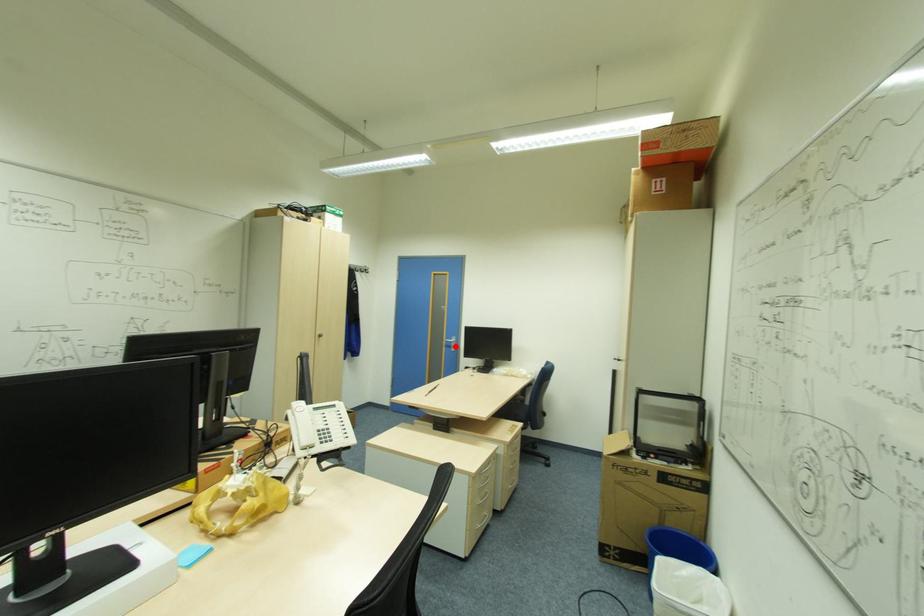
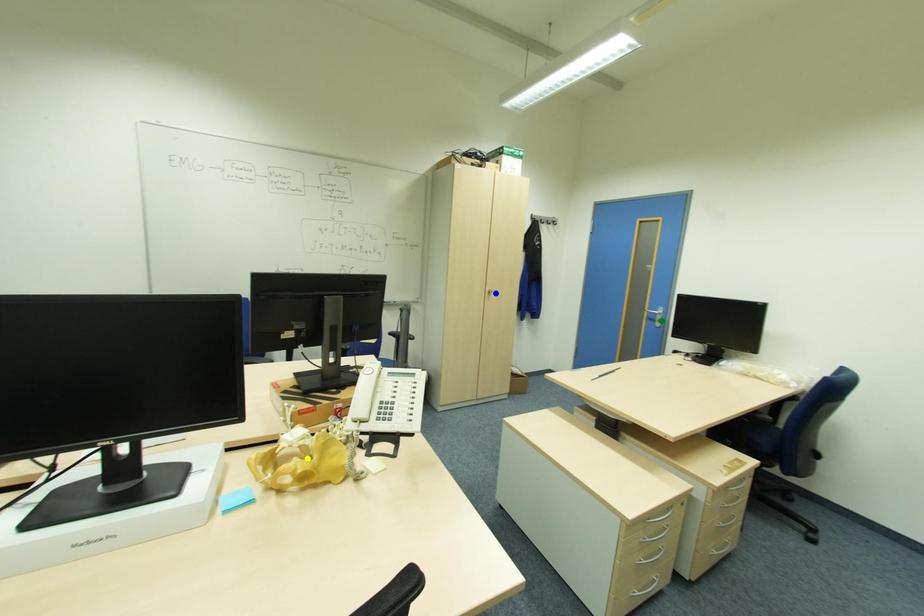
Question: I am providing you with two images of the same scene from different viewpoints. A red point is marked on the first image. You are given multiple points on the second image. In image 2, which mark is for the same physical point as the one in image 1?

Choices:
 (A) yellow point
 (B) green point
 (C) blue point

Answer: (B)